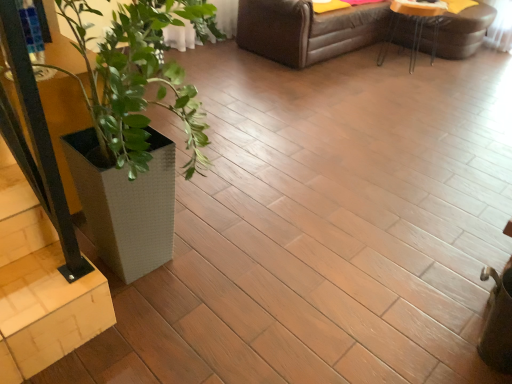
Locate an element on the screen. white textured planter at left is located at coordinates (138, 101).

What do you see at coordinates (414, 26) in the screenshot? I see `wooden table at upper right` at bounding box center [414, 26].

This screenshot has width=512, height=384. What are the coordinates of `wooden table at upper right` in the screenshot? It's located at (414, 26).

Locate an element on the screen. The image size is (512, 384). light wood stairwell at lower left is located at coordinates (40, 286).

Considering the sizes of objects white textured planter at lower left and white textured planter at left in the image provided, who is wider, white textured planter at lower left or white textured planter at left?

Wider between the two is white textured planter at left.

Considering the relative sizes of white textured planter at lower left and white textured planter at left in the image provided, is white textured planter at lower left bigger than white textured planter at left?

No, white textured planter at lower left is not bigger than white textured planter at left.

Which is in front, point (135, 206) or point (120, 50)?

Positioned in front is point (135, 206).

How many degrees apart are the facing directions of white textured planter at lower left and white textured planter at left?

white textured planter at lower left and white textured planter at left are facing 0.000663 degrees away from each other.

Between white textured planter at left and wooden table at upper right, which one has smaller size?

Smaller between the two is wooden table at upper right.

Can you confirm if white textured planter at left is shorter than wooden table at upper right?

No, white textured planter at left is not shorter than wooden table at upper right.

I want to click on table that is behind the white textured planter at left, so click(x=414, y=26).

Is point (110, 50) positioned after point (413, 45)?

No, (110, 50) is closer to viewer.

From a real-world perspective, is white textured planter at left located higher than white textured planter at lower left?

Yes, from a real-world perspective, white textured planter at left is on top of white textured planter at lower left.

Considering the points (64, 221) and (95, 209), which point is behind, point (64, 221) or point (95, 209)?

The point (95, 209) is farther from the camera.

Does white textured planter at left have a lesser height compared to white textured planter at lower left?

No.

Is wooden table at upper right oriented towards white textured planter at lower left?

No, wooden table at upper right does not turn towards white textured planter at lower left.

The image size is (512, 384). I want to click on flowerpot above the wooden table at upper right (from a real-world perspective), so click(125, 204).

From the image's perspective, which one is positioned higher, wooden table at upper right or white textured planter at lower left?

From the image's view, wooden table at upper right is above.

Is point (382, 47) more distant than point (173, 195)?

Yes, it is.

Considering the sizes of objects light wood stairwell at lower left and white textured planter at left in the image provided, who is shorter, light wood stairwell at lower left or white textured planter at left?

light wood stairwell at lower left is shorter.

Is light wood stairwell at lower left placed right next to white textured planter at left?

There is a gap between light wood stairwell at lower left and white textured planter at left.

Which of these two, light wood stairwell at lower left or white textured planter at left, is bigger?

white textured planter at left.

Can you confirm if light wood stairwell at lower left is wider than white textured planter at left?

No.

Between white textured planter at lower left and wooden table at upper right, which one has smaller size?

With smaller size is white textured planter at lower left.

From a real-world perspective, between white textured planter at lower left and wooden table at upper right, who is vertically higher?

From a 3D spatial view, white textured planter at lower left is above.

Is white textured planter at lower left facing towards wooden table at upper right?

Yes, white textured planter at lower left is oriented towards wooden table at upper right.

Considering the sizes of white textured planter at lower left and wooden table at upper right in the image, is white textured planter at lower left taller or shorter than wooden table at upper right?

Clearly, white textured planter at lower left is taller compared to wooden table at upper right.

Is light wood stairwell at lower left outside of white textured planter at lower left?

That's correct, light wood stairwell at lower left is outside of white textured planter at lower left.

Locate an element on the screen. Image resolution: width=512 pixels, height=384 pixels. flowerpot above the light wood stairwell at lower left (from a real-world perspective) is located at coordinates (125, 204).

Are light wood stairwell at lower left and white textured planter at lower left beside each other?

No, light wood stairwell at lower left is not next to white textured planter at lower left.

The height and width of the screenshot is (384, 512). I want to click on houseplant to the right of white textured planter at lower left, so click(138, 101).

The width and height of the screenshot is (512, 384). Identify the location of houseplant above the wooden table at upper right (from a real-world perspective). (138, 101).

Looking at the image, which one is located further to white textured planter at lower left, light wood stairwell at lower left or wooden table at upper right?

wooden table at upper right lies further to white textured planter at lower left than the other object.

Based on their spatial positions, is wooden table at upper right or light wood stairwell at lower left further from white textured planter at left?

wooden table at upper right is further to white textured planter at left.

Which object lies nearer to the anchor point white textured planter at lower left, wooden table at upper right or white textured planter at left?

Among the two, white textured planter at left is located nearer to white textured planter at lower left.

When comparing their distances from white textured planter at left, does white textured planter at lower left or wooden table at upper right seem closer?

The object closer to white textured planter at left is white textured planter at lower left.

Estimate the real-world distances between objects in this image. Which object is closer to light wood stairwell at lower left, wooden table at upper right or white textured planter at left?

white textured planter at left is closer to light wood stairwell at lower left.

Based on the photo, based on their spatial positions, is white textured planter at left or white textured planter at lower left further from light wood stairwell at lower left?

The object further to light wood stairwell at lower left is white textured planter at left.

Estimate the real-world distances between objects in this image. Which object is closer to white textured planter at left, white textured planter at lower left or light wood stairwell at lower left?

white textured planter at lower left is closer to white textured planter at left.

Considering their positions, is white textured planter at left positioned closer to white textured planter at lower left than wooden table at upper right?

Based on the image, white textured planter at left appears to be nearer to white textured planter at lower left.

Locate an element on the screen. This screenshot has width=512, height=384. flowerpot between light wood stairwell at lower left and wooden table at upper right from front to back is located at coordinates (125, 204).

The width and height of the screenshot is (512, 384). I want to click on flowerpot between white textured planter at left and wooden table at upper right from front to back, so click(125, 204).

The height and width of the screenshot is (384, 512). Identify the location of stairwell located between white textured planter at left and wooden table at upper right in the depth direction. pyautogui.click(x=40, y=286).

The height and width of the screenshot is (384, 512). Identify the location of flowerpot between white textured planter at left and light wood stairwell at lower left in the vertical direction. (125, 204).